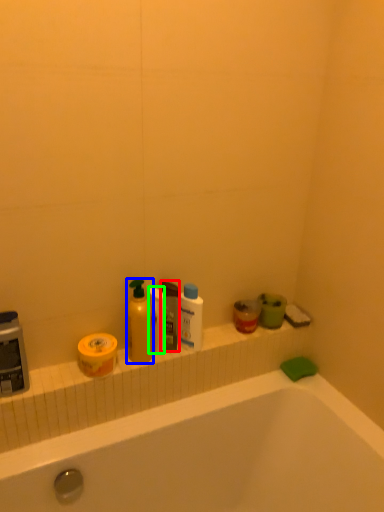
Question: Considering the real-world distances, which object is farthest from mouthwash (highlighted by a red box)? cleaning product (highlighted by a blue box) or toilet paper (highlighted by a green box)?

Choices:
 (A) cleaning product
 (B) toilet paper

Answer: (A)